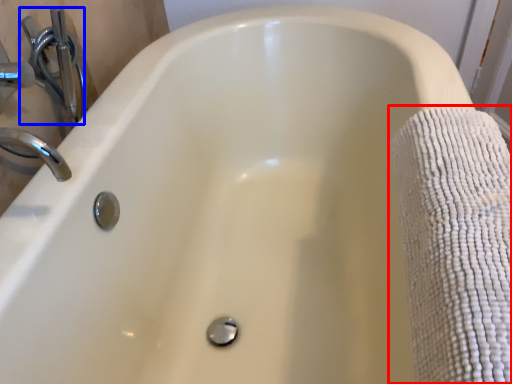
Question: Which of the following is the closest to the observer, bath towel (highlighted by a red box) or plumbing fixture (highlighted by a blue box)?

Choices:
 (A) bath towel
 (B) plumbing fixture

Answer: (A)